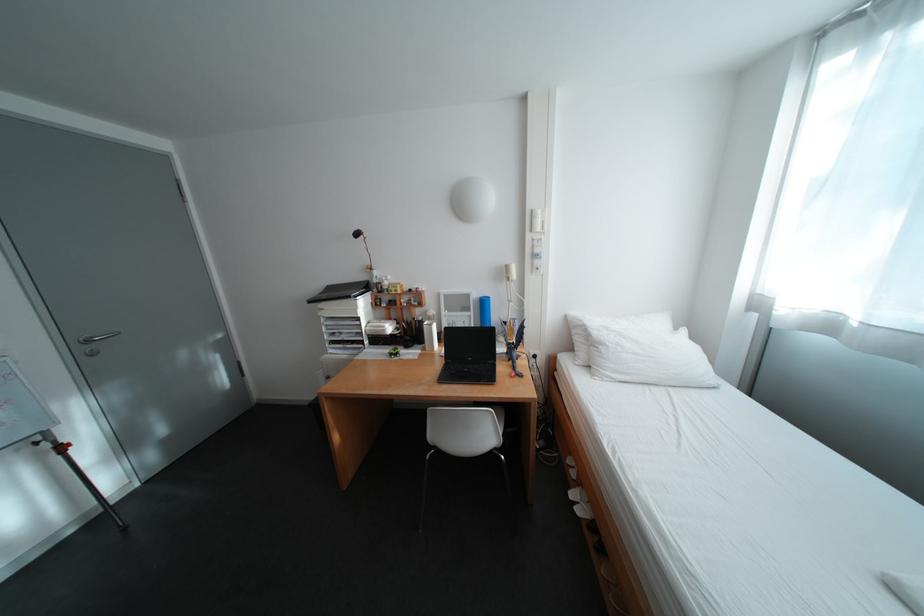
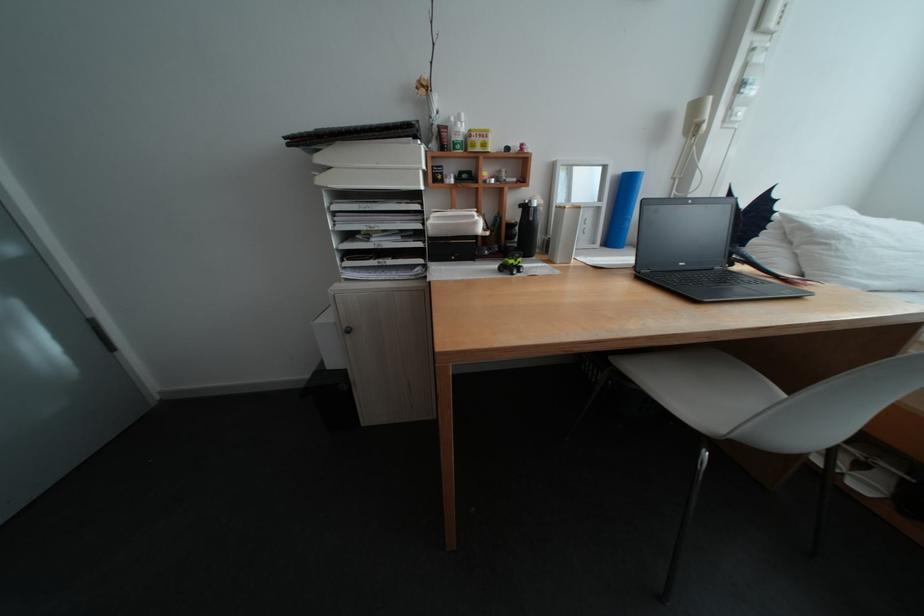
Where in the second image is the point corresponding to (x=484, y=314) from the first image?

(616, 205)